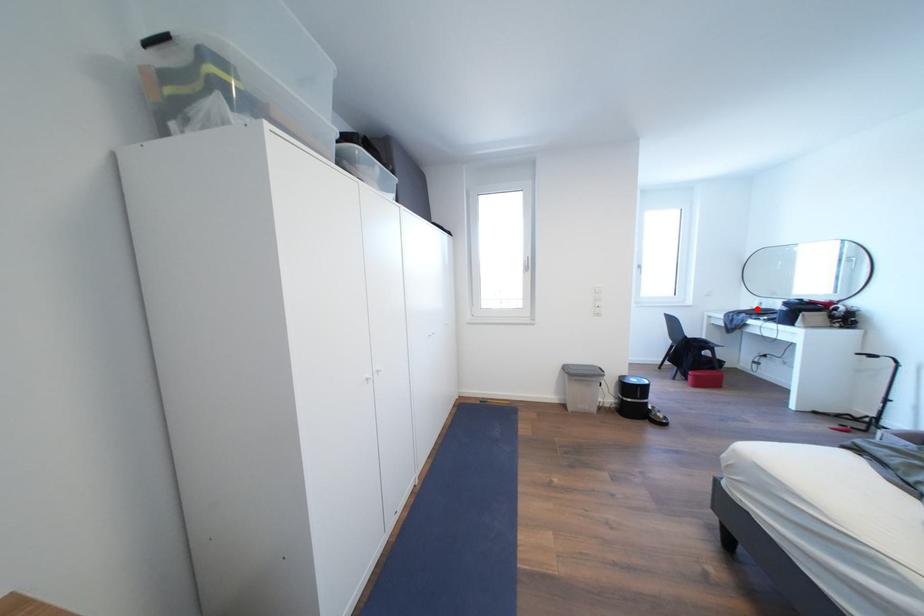
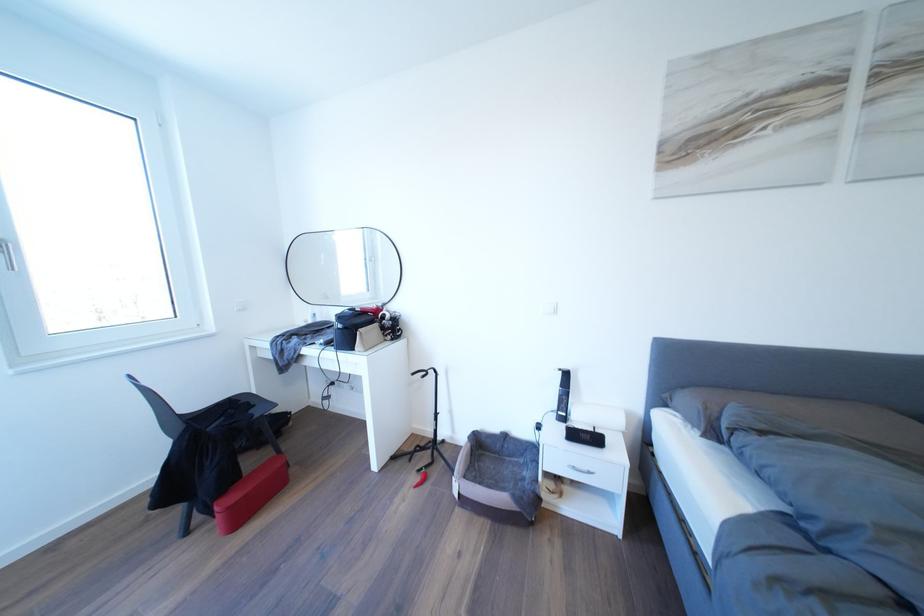
Find the pixel in the second image that matches the highlighted location in the first image.

(310, 322)